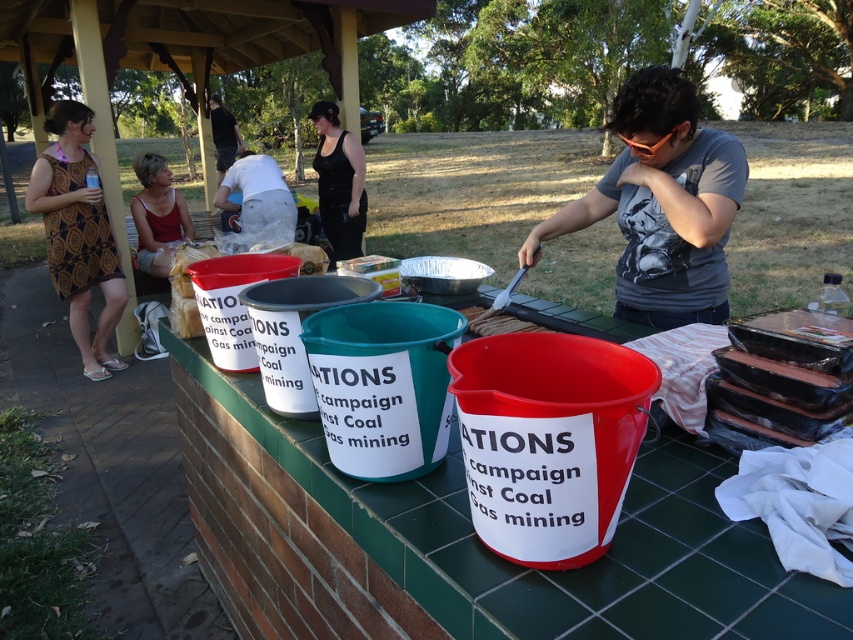
Does black fabric at center have a greater width compared to matte red tank top at left?

In fact, black fabric at center might be narrower than matte red tank top at left.

From the picture: Can you confirm if black fabric at center is smaller than matte red tank top at left?

Yes, black fabric at center is smaller than matte red tank top at left.

Who is more distant from viewer, [318,132] or [155,198]?

Positioned behind is point [318,132].

This screenshot has width=853, height=640. I want to click on black fabric at center, so click(339, 182).

What do you see at coordinates (78, 234) in the screenshot? This screenshot has width=853, height=640. I see `patterned fabric dress at left` at bounding box center [78, 234].

Can you confirm if patterned fabric dress at left is wider than black fabric at center?

Indeed, patterned fabric dress at left has a greater width compared to black fabric at center.

Does point (119, 307) come farther from viewer compared to point (317, 129)?

No, it is in front of (317, 129).

Image resolution: width=853 pixels, height=640 pixels. Identify the location of patterned fabric dress at left. (78, 234).

Based on the photo, can you confirm if patterned fabric dress at left is positioned to the right of matte red tank top at left?

In fact, patterned fabric dress at left is to the left of matte red tank top at left.

Between point (68, 246) and point (151, 218), which one is positioned behind?

The point (151, 218) is more distant.

Where is `patterned fabric dress at left`? This screenshot has width=853, height=640. patterned fabric dress at left is located at coordinates (78, 234).

At what (x,y) coordinates should I click in order to perform the action: click on patterned fabric dress at left. Please return your answer as a coordinate pair (x, y). This screenshot has height=640, width=853. Looking at the image, I should click on (78, 234).